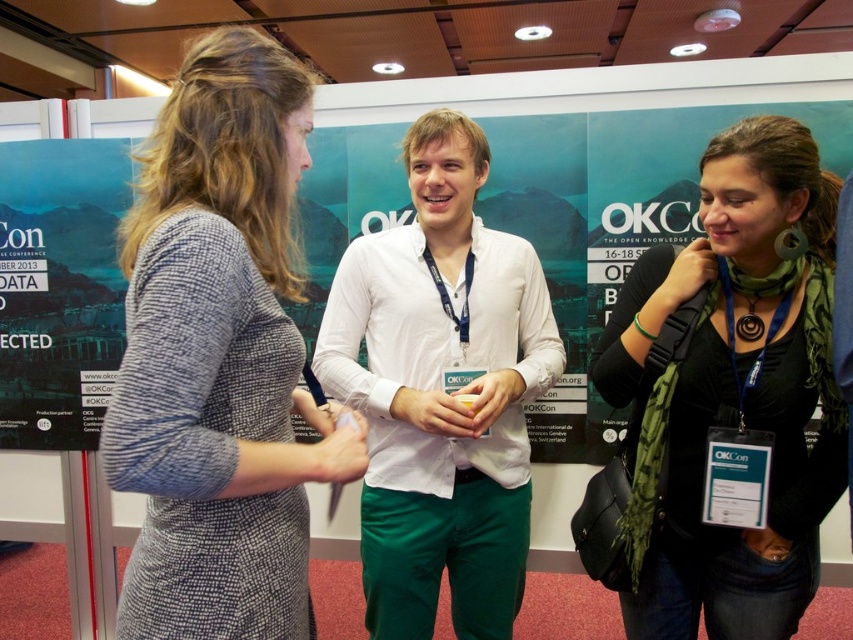
You are an event coordinator at OKCon and need to arrange a photo shoot. The photographer wants to ensure that the textured gray dress at center and the matte paper poster at left are both visible in the frame. Based on their positions, which object should be placed closer to the camera to ensure both are in focus?

The textured gray dress at center is positioned on the right side of matte paper poster at left. To ensure both are in focus, the matte paper poster at left should be placed closer to the camera since it is to the left of the textured gray dress at center, allowing the depth of field to cover both objects effectively.

From the picture: You are a photographer positioned at the camera. You need to capture a closeup shot of the textured gray dress at center. Given that your camera can focus on objects within 30 inches, will you be able to take the closeup without moving closer?

The distance between the textured gray dress at center and the camera is 31.65 inches, which is slightly beyond the camera focus range of 30 inches. Therefore, you need to move closer to take the closeup.